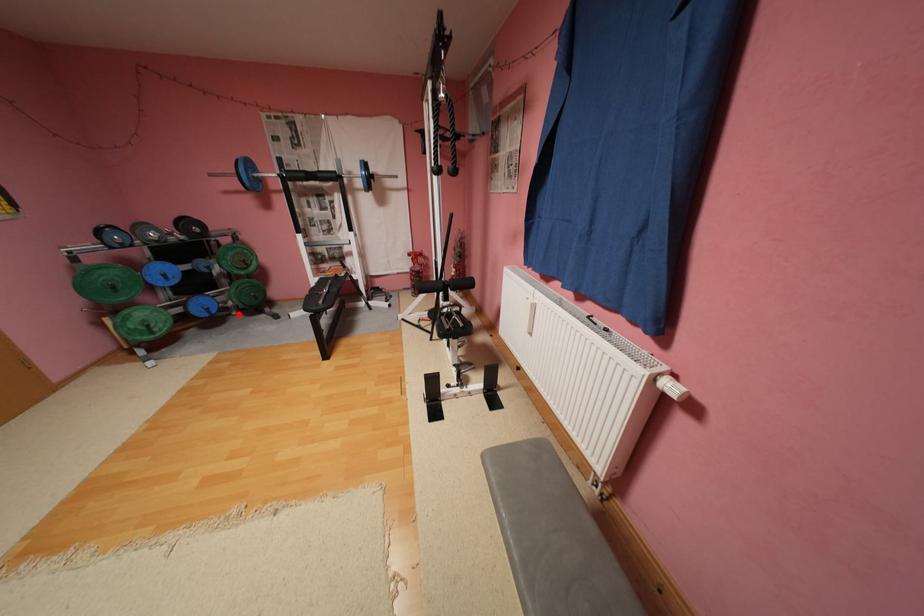
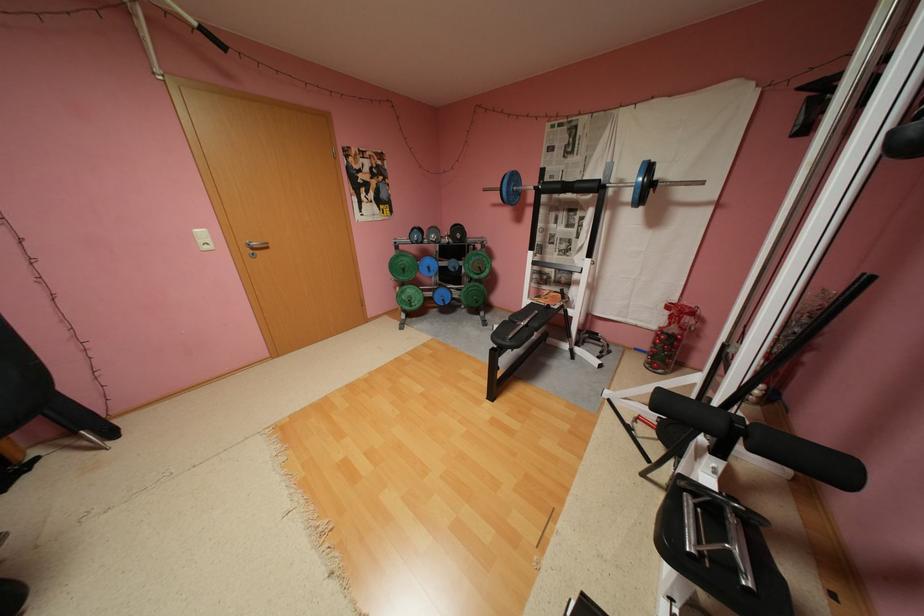
Question: I am providing you with two images of the same scene from different viewpoints. Given a red point in image1, look at the same physical point in image2. Is it:

Choices:
 (A) Closer to the viewpoint
 (B) Farther from the viewpoint

Answer: (A)